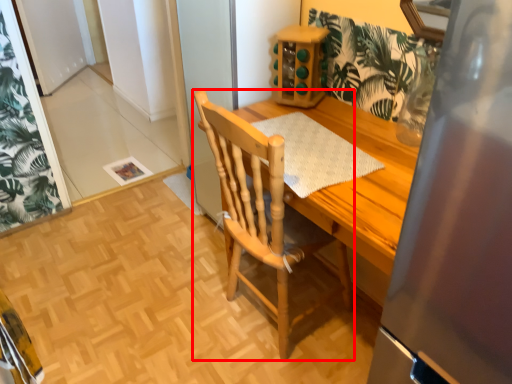
Question: In this image, where is chair (annotated by the red box) located relative to place mat?

Choices:
 (A) right
 (B) left

Answer: (B)